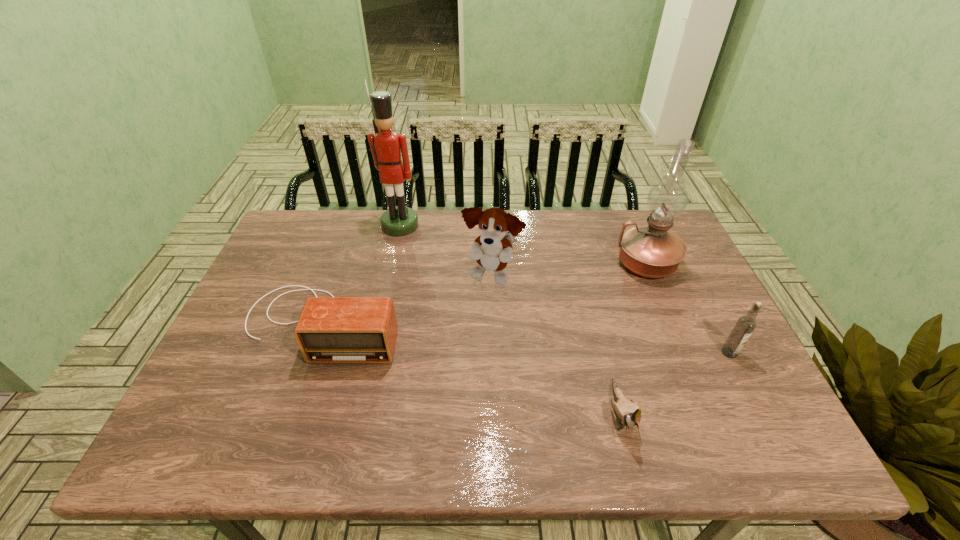
Where is `blank area located 0.090m on the front of the fifth shortest object`? blank area located 0.090m on the front of the fifth shortest object is located at coordinates (664, 308).

Find the location of `free space located on the face of the third tallest object`. free space located on the face of the third tallest object is located at coordinates (494, 374).

What are the coordinates of `vacant space positioned 0.210m on the label of the vodka` in the screenshot? It's located at (775, 441).

Find the location of a particular element. free space located 0.050m on the front-facing side of the radio receiver is located at coordinates (301, 383).

Identify the location of nutcracker that is at the far edge. Image resolution: width=960 pixels, height=540 pixels. (386, 146).

Where is `oil lamp that is at the far edge`? oil lamp that is at the far edge is located at coordinates (652, 251).

You are a GUI agent. You are given a task and a screenshot of the screen. Output one action in this format:
    pyautogui.click(x=<x>, y=<y>)
    Task: Click on the object located in the near edge section of the desktop
    Image resolution: width=960 pixels, height=540 pixels.
    Given the screenshot: What is the action you would take?
    pyautogui.click(x=628, y=413)

Identify the location of object at the left edge. (332, 329).

Locate an element on the screen. Image resolution: width=960 pixels, height=540 pixels. oil lamp that is at the right edge is located at coordinates (652, 251).

At what (x,y) coordinates should I click in order to perform the action: click on vodka at the right edge. Please return your answer as a coordinate pair (x, y). This screenshot has width=960, height=540. Looking at the image, I should click on (745, 325).